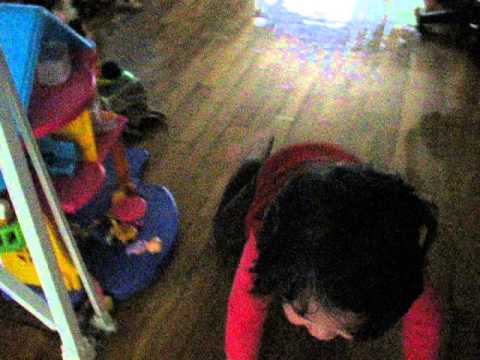
The image size is (480, 360). Identify the location of yellow wall of doll house. (85, 132).